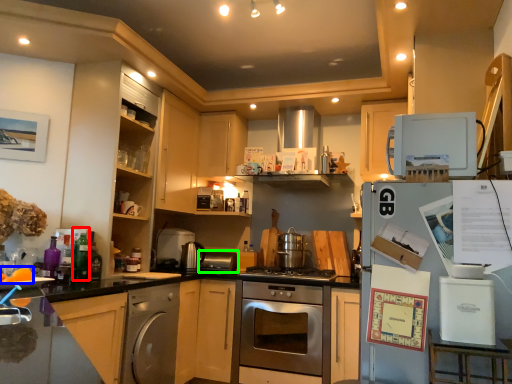
Question: Which is nearer to the bottle (highlighted by a red box)? food (highlighted by a blue box) or appliance (highlighted by a green box).

Choices:
 (A) food
 (B) appliance

Answer: (A)